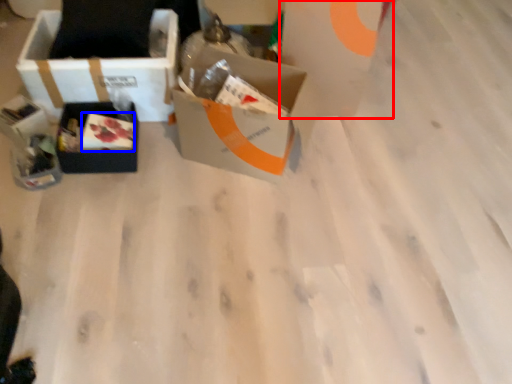
Question: Among these objects, which one is nearest to the camera, cardboard box (highlighted by a red box) or food (highlighted by a blue box)?

Choices:
 (A) cardboard box
 (B) food

Answer: (A)